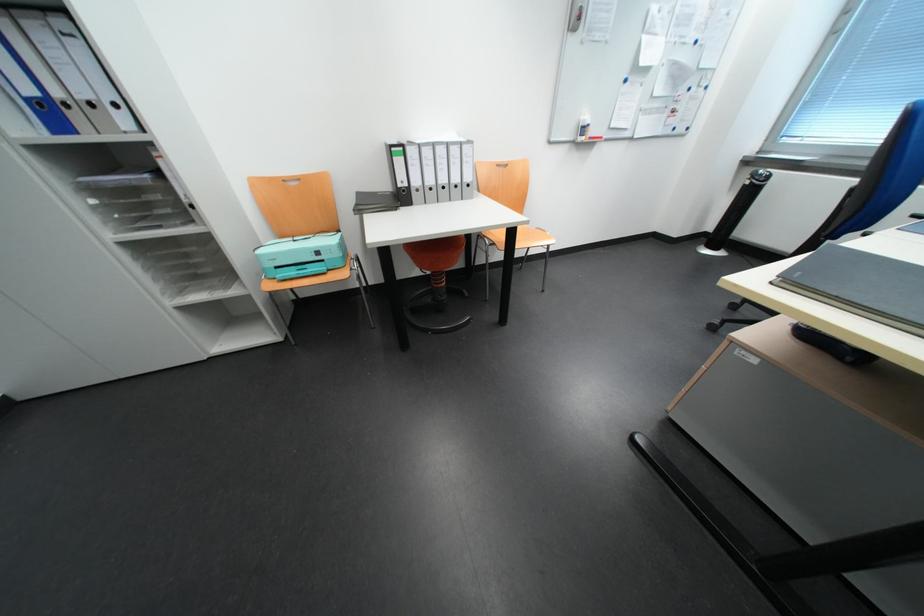
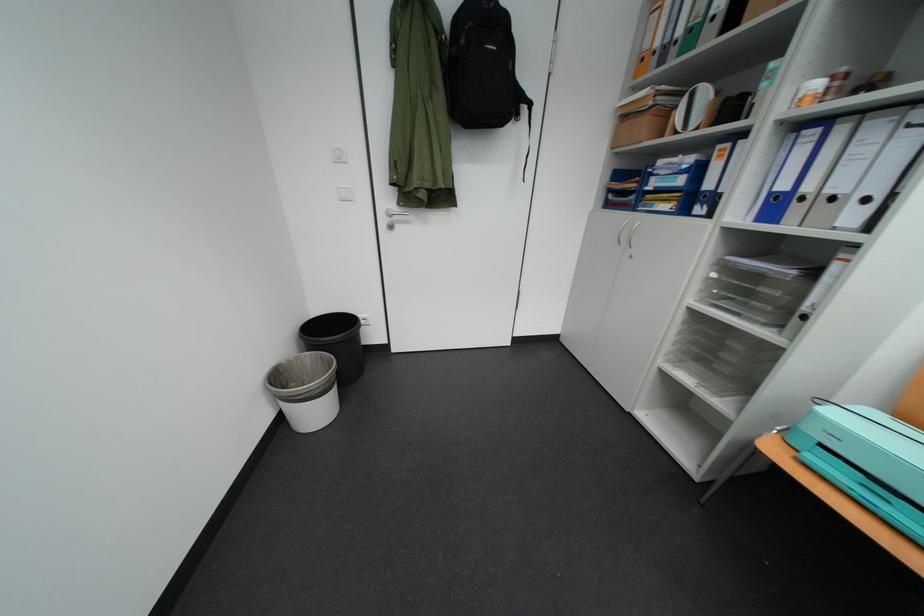
Where in the second image is the point corresponding to [282,288] from the first image?

(784, 451)